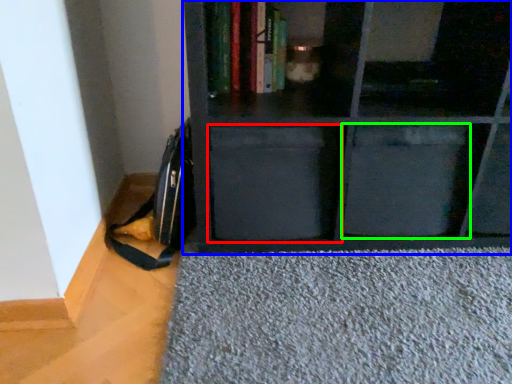
Question: Which object is the farthest from drawer (highlighted by a red box)? Choose among these: shelf (highlighted by a blue box) or drawer (highlighted by a green box).

Choices:
 (A) shelf
 (B) drawer

Answer: (B)